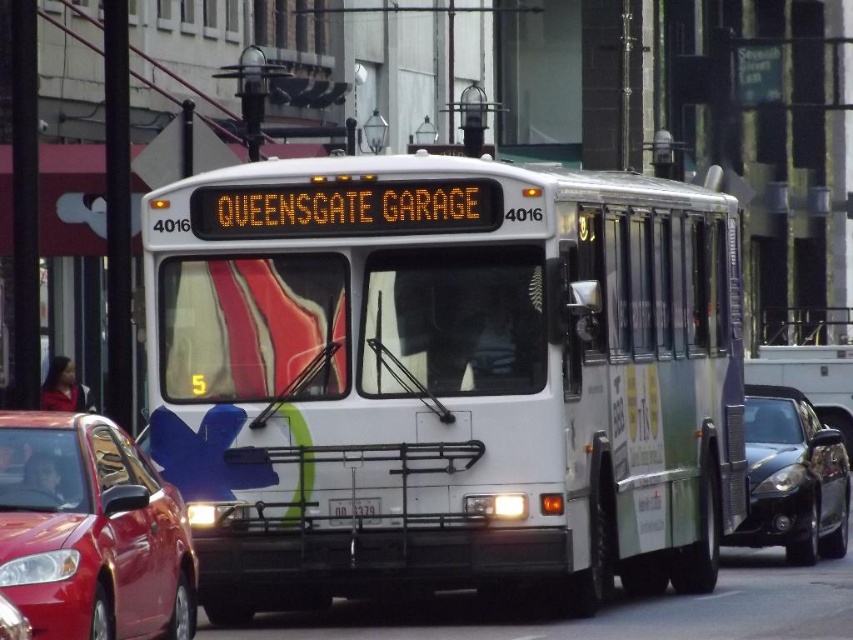
Does white matte bus at center appear under white plastic license plate at center?

No, white matte bus at center is not below white plastic license plate at center.

Is white matte bus at center smaller than white plastic license plate at center?

Incorrect, white matte bus at center is not smaller in size than white plastic license plate at center.

Describe the element at coordinates (444, 376) in the screenshot. I see `white matte bus at center` at that location.

Locate an element on the screen. The width and height of the screenshot is (853, 640). white matte bus at center is located at coordinates (444, 376).

Does shiny red sedan at left appear on the right side of white plastic license plate at center?

Incorrect, shiny red sedan at left is not on the right side of white plastic license plate at center.

Which is above, shiny red sedan at left or white plastic license plate at center?

shiny red sedan at left

Does point (19, 435) lie behind point (363, 515)?

No, (19, 435) is in front of (363, 515).

This screenshot has width=853, height=640. I want to click on shiny red sedan at left, so click(90, 531).

Does shiny red sedan at left have a smaller size compared to shiny black sedan at right?

Yes, shiny red sedan at left is smaller than shiny black sedan at right.

Does point (38, 460) lie behind point (827, 444)?

No, (38, 460) is closer to viewer.

Where is `shiny red sedan at left`? shiny red sedan at left is located at coordinates (90, 531).